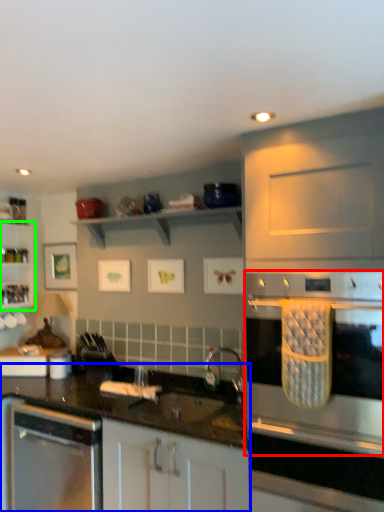
Question: Which object is positioned farthest from home appliance (highlighted by a red box)? Select from countertop (highlighted by a blue box) and shelf (highlighted by a green box).

Choices:
 (A) countertop
 (B) shelf

Answer: (B)